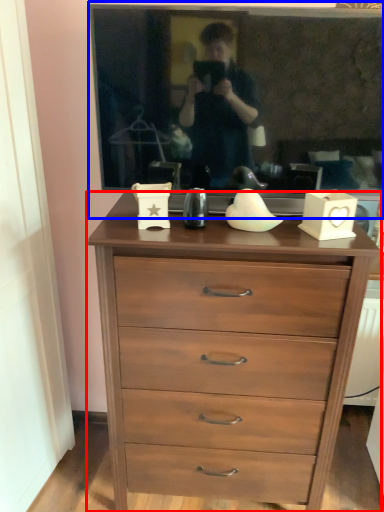
Question: Which object is closer to the camera taking this photo, chest of drawers (highlighted by a red box) or picture frame (highlighted by a blue box)?

Choices:
 (A) chest of drawers
 (B) picture frame

Answer: (B)